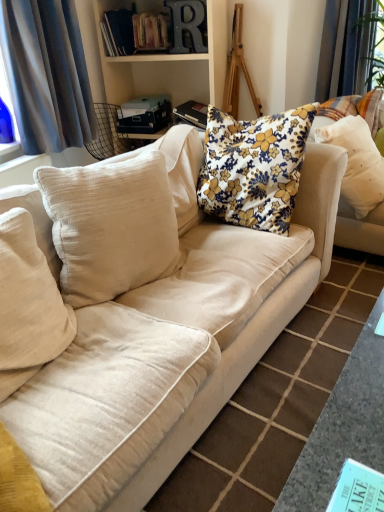
Image resolution: width=384 pixels, height=512 pixels. What do you see at coordinates (139, 318) in the screenshot? I see `beige fabric couch at center` at bounding box center [139, 318].

This screenshot has width=384, height=512. In order to click on white textured pillow at upper right, which ranks as the 4th pillow in left-to-right order in this screenshot , I will do pyautogui.click(x=356, y=162).

In order to click on floral fabric cushion at center, the third pillow in the left-to-right sequence in this screenshot , I will do `click(254, 167)`.

Locate an element on the screen. beige fabric couch at center is located at coordinates (139, 318).

Which is behind, point (5, 46) or point (11, 324)?

Positioned behind is point (5, 46).

Is gray fabric curtain at left outside of beige cotton pillow at left, which is the fourth pillow in right-to-left order?

Yes, gray fabric curtain at left is not within beige cotton pillow at left, which is the fourth pillow in right-to-left order.

Can you confirm if gray fabric curtain at left is taller than beige cotton pillow at left, which is the fourth pillow in right-to-left order?

Yes.

Is gray fabric curtain at left aimed at beige cotton pillow at left, which is the fourth pillow in right-to-left order?

No, gray fabric curtain at left does not turn towards beige cotton pillow at left, which is the fourth pillow in right-to-left order.

From a real-world perspective, is beige cotton pillow at left, which is the fourth pillow in right-to-left order, located higher than floral fabric cushion at center, the third pillow in the left-to-right sequence?

No, from a real-world perspective, beige cotton pillow at left, which is the fourth pillow in right-to-left order, is not above floral fabric cushion at center, the third pillow in the left-to-right sequence.

Which is closer, (9, 323) or (281, 207)?

The point (9, 323) is in front.

Does beige cotton pillow at left, arranged as the 1th pillow when viewed from the left, turn towards floral fabric cushion at center, the third pillow in the left-to-right sequence?

No, beige cotton pillow at left, arranged as the 1th pillow when viewed from the left, is not turned towards floral fabric cushion at center, the third pillow in the left-to-right sequence.

Can you confirm if beige cotton pillow at left, which appears as the second pillow when viewed from the left, is shorter than teal paper book at lower right, arranged as the 1th book when viewed from the right?

Answer: In fact, beige cotton pillow at left, which appears as the second pillow when viewed from the left, may be taller than teal paper book at lower right, arranged as the 1th book when viewed from the right.

How many degrees apart are the facing directions of beige cotton pillow at left, which appears as the second pillow when viewed from the left, and teal paper book at lower right, positioned as the 1th book in bottom-to-top order?

beige cotton pillow at left, which appears as the second pillow when viewed from the left, and teal paper book at lower right, positioned as the 1th book in bottom-to-top order, are facing 175 degrees away from each other.

Which of these two, beige cotton pillow at left, which appears as the second pillow when viewed from the left, or teal paper book at lower right, arranged as the 1th book when viewed from the right, is thinner?

Thinner between the two is teal paper book at lower right, arranged as the 1th book when viewed from the right.

Consider the image. From a real-world perspective, is black hardcover book at upper center, positioned as the fourth book in right-to-left order, above or below gray fabric curtain at left?

black hardcover book at upper center, positioned as the fourth book in right-to-left order, is situated higher than gray fabric curtain at left in the real world.

Does point (115, 11) appear closer or farther from the camera than point (51, 46)?

Point (115, 11) is farther from the camera than point (51, 46).

You are a GUI agent. You are given a task and a screenshot of the screen. Output one action in this format:
    pyautogui.click(x=<x>, y=<y>)
    Task: Click on the curtain to the left of black hardcover book at upper center, the first book when ordered from left to right
    
    Given the screenshot: What is the action you would take?
    pyautogui.click(x=47, y=74)

How many degrees apart are the facing directions of white textured pillow at upper right, which ranks as the 4th pillow in left-to-right order, and beige fabric couch at center?

white textured pillow at upper right, which ranks as the 4th pillow in left-to-right order, and beige fabric couch at center are facing 2.16 degrees away from each other.

Could beige fabric couch at center be considered to be inside white textured pillow at upper right, which ranks as the 4th pillow in left-to-right order?

No, beige fabric couch at center is not inside white textured pillow at upper right, which ranks as the 4th pillow in left-to-right order.

From the picture: Is white textured pillow at upper right, which ranks as the 4th pillow in left-to-right order, aimed at beige fabric couch at center?

No, white textured pillow at upper right, which ranks as the 4th pillow in left-to-right order, is not turned towards beige fabric couch at center.

Does point (360, 125) come behind point (67, 185)?

Yes, point (360, 125) is behind point (67, 185).

From a real-world perspective, is beige cotton pillow at left, arranged as the 1th pillow when viewed from the left, above or below teal paper book at lower right, acting as the fourth book starting from the top?

In terms of real-world spatial position, beige cotton pillow at left, arranged as the 1th pillow when viewed from the left, is above teal paper book at lower right, acting as the fourth book starting from the top.

At what (x,y) coordinates should I click in order to perform the action: click on the 1st pillow positioned above the teal paper book at lower right, positioned as the fourth book in back-to-front order (from the image's perspective). Please return your answer as a coordinate pair (x, y). Looking at the image, I should click on (28, 305).

Choose the correct answer: Is beige cotton pillow at left, arranged as the 1th pillow when viewed from the left, inside teal paper book at lower right, marked as the first book in a front-to-back arrangement, or outside it?

The correct answer is: outside.

Looking at their sizes, would you say beige cotton pillow at left, which is the fourth pillow in right-to-left order, is wider or thinner than teal paper book at lower right, the fourth book from the left?

Clearly, beige cotton pillow at left, which is the fourth pillow in right-to-left order, has more width compared to teal paper book at lower right, the fourth book from the left.

Between point (207, 181) and point (342, 473), which one is positioned in front?

The point (342, 473) is in front.

Is floral fabric cushion at center, the third pillow in the left-to-right sequence, not near teal paper book at lower right, the fourth book from the left?

Absolutely, floral fabric cushion at center, the third pillow in the left-to-right sequence, is distant from teal paper book at lower right, the fourth book from the left.

Considering the relative sizes of floral fabric cushion at center, the 2th pillow in the right-to-left sequence, and teal paper book at lower right, positioned as the 1th book in bottom-to-top order, in the image provided, is floral fabric cushion at center, the 2th pillow in the right-to-left sequence, wider than teal paper book at lower right, positioned as the 1th book in bottom-to-top order,?

No, floral fabric cushion at center, the 2th pillow in the right-to-left sequence, is not wider than teal paper book at lower right, positioned as the 1th book in bottom-to-top order.

Consider the image. Considering the relative positions of floral fabric cushion at center, the 2th pillow in the right-to-left sequence, and teal paper book at lower right, the fourth book from the left, in the image provided, is floral fabric cushion at center, the 2th pillow in the right-to-left sequence, to the right of teal paper book at lower right, the fourth book from the left, from the viewer's perspective?

No, floral fabric cushion at center, the 2th pillow in the right-to-left sequence, is not to the right of teal paper book at lower right, the fourth book from the left.

You are a GUI agent. You are given a task and a screenshot of the screen. Output one action in this format:
    pyautogui.click(x=<x>, y=<y>)
    Task: Click on the 1st pillow to the right of the gray fabric curtain at left, starting your count from the anchor
    This screenshot has height=512, width=384.
    Given the screenshot: What is the action you would take?
    pyautogui.click(x=28, y=305)

From a real-world perspective, starting from the floral fabric cushion at center, the 2th pillow in the right-to-left sequence, which pillow is the 2nd one below it? Please provide its 2D coordinates.

[(28, 305)]

Based on their spatial positions, is floral fabric cushion at center, the third pillow in the left-to-right sequence, or beige fabric couch at center closer to beige cotton pillow at left, arranged as the 1th pillow when viewed from the left?

beige fabric couch at center is closer to beige cotton pillow at left, arranged as the 1th pillow when viewed from the left.

Considering their positions, is black hardcover book at upper center, the first book when ordered from left to right, positioned further to teal paper book at lower right, the fourth book from the left, than hardcover books at upper center, which is counted as the 3th book, starting from the back?

Based on the image, black hardcover book at upper center, the first book when ordered from left to right, appears to be further to teal paper book at lower right, the fourth book from the left.

Estimate the real-world distances between objects in this image. Which object is further from floral fabric book at upper center, the fourth book when ordered from front to back, hardcover books at upper center, which is counted as the 3th book, starting from the back, or beige cotton pillow at left, which is the fourth pillow in right-to-left order?

Among the two, beige cotton pillow at left, which is the fourth pillow in right-to-left order, is located further to floral fabric book at upper center, the fourth book when ordered from front to back.

Considering their positions, is black hardcover book at upper center, marked as the 2th book in a back-to-front arrangement, positioned further to hardcover books at upper center, which is counted as the 3th book, starting from the back, than gray fabric curtain at left?

gray fabric curtain at left is further to hardcover books at upper center, which is counted as the 3th book, starting from the back.

When comparing their distances from beige fabric couch at center, does hardcover books at upper center, which is counted as the 3th book, starting from the back, or beige cotton pillow at left, which is counted as the third pillow, starting from the right, seem closer?

Based on the image, beige cotton pillow at left, which is counted as the third pillow, starting from the right, appears to be nearer to beige fabric couch at center.

When comparing their distances from hardcover books at upper center, which is counted as the 3th book, starting from the back, does teal paper book at lower right, marked as the first book in a front-to-back arrangement, or black hardcover book at upper center, the first book when ordered from left to right, seem further?

teal paper book at lower right, marked as the first book in a front-to-back arrangement, is positioned further to the anchor hardcover books at upper center, which is counted as the 3th book, starting from the back.

From the image, which object appears to be nearer to teal paper book at lower right, acting as the fourth book starting from the top, beige cotton pillow at left, which appears as the second pillow when viewed from the left, or floral fabric cushion at center, the third pillow in the left-to-right sequence?

The object closer to teal paper book at lower right, acting as the fourth book starting from the top, is beige cotton pillow at left, which appears as the second pillow when viewed from the left.

Consider the image. Considering their positions, is floral fabric book at upper center, arranged as the second book when ordered from the bottom, positioned further to beige cotton pillow at left, which is counted as the third pillow, starting from the right, than gray fabric curtain at left?

The object further to beige cotton pillow at left, which is counted as the third pillow, starting from the right, is floral fabric book at upper center, arranged as the second book when ordered from the bottom.

In order to click on studio couch located between teal paper book at lower right, positioned as the fourth book in back-to-front order, and gray fabric curtain at left in the depth direction in this screenshot , I will do `click(139, 318)`.

Where is `curtain positioned between beige cotton pillow at left, which is counted as the third pillow, starting from the right, and black hardcover book at upper center, marked as the 2th book in a back-to-front arrangement, from near to far`? curtain positioned between beige cotton pillow at left, which is counted as the third pillow, starting from the right, and black hardcover book at upper center, marked as the 2th book in a back-to-front arrangement, from near to far is located at coordinates (47, 74).

Find the location of a particular element. pillow between floral fabric cushion at center, the third pillow in the left-to-right sequence, and floral fabric book at upper center, which ranks as the first book in back-to-front order, along the z-axis is located at coordinates point(356,162).

Where is `curtain between beige fabric couch at center and floral fabric book at upper center, which appears as the 2th book when viewed from the right, in the front-back direction`? curtain between beige fabric couch at center and floral fabric book at upper center, which appears as the 2th book when viewed from the right, in the front-back direction is located at coordinates (47, 74).